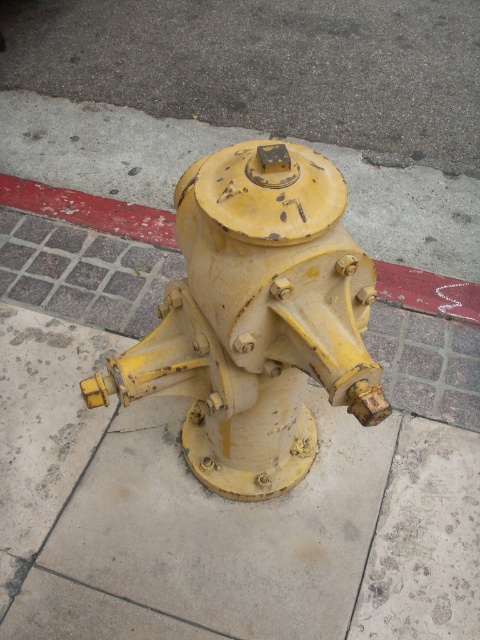
You are a delivery driver and need to park your vehicle near the yellow matte hydrant at center. The parking spot is behind the red painted concrete curb at lower center. Can you safely park your vehicle there without blocking the hydrant?

The yellow matte hydrant at center is positioned under the red painted concrete curb at lower center, so parking behind the curb would place your vehicle near the hydrant. However, blocking a fire hydrant is illegal and unsafe. You should park at least 10 feet away from the hydrant to ensure it remains accessible.

You are a delivery person with a 4 feet wide cart. You need to park your cart between the yellow matte hydrant at center and the red painted concrete curb at lower center. Is there enough space for your cart?

The distance between the yellow matte hydrant at center and the red painted concrete curb at lower center is 3.79 feet. Since your cart is 4 feet wide, it is slightly wider than the available space. Therefore, there is not enough space to park the cart between them.

You are a delivery driver who needs to park your truck near the yellow matte hydrant at center. The parking spot is behind the red painted concrete curb at lower center. Can you park your truck in a way that it doesn not block the hydrant?

The yellow matte hydrant at center is in front of the red painted concrete curb at lower center. Since the hydrant is in front of the curb, parking behind the curb would place the truck behind the hydrant, so it won not block the hydrant.